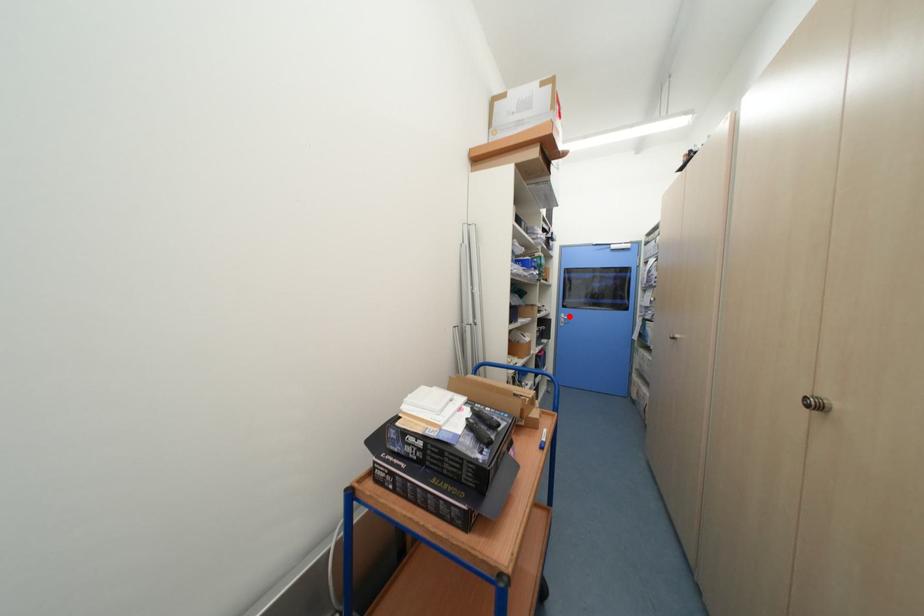
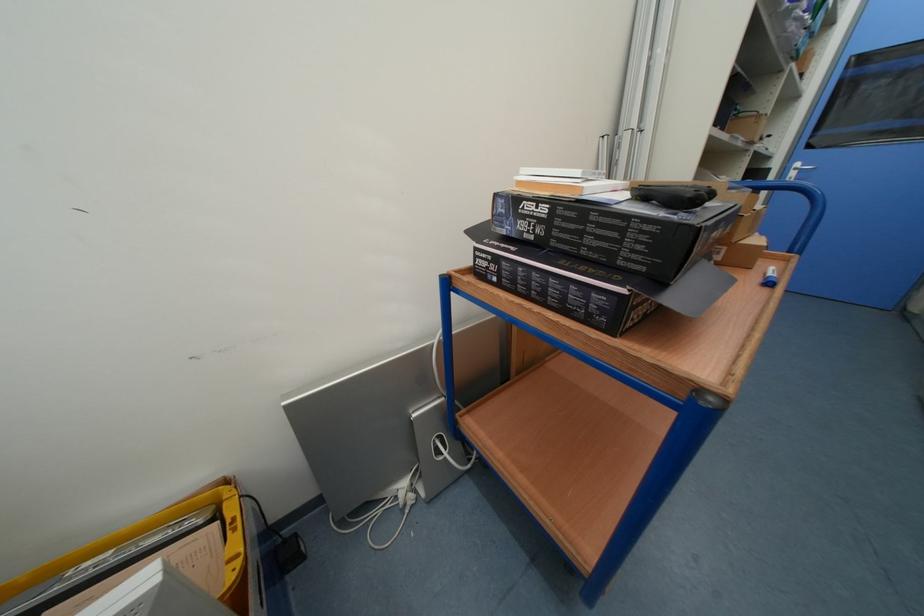
In the second image, find the point that corresponds to the highlighted location in the first image.

(804, 166)